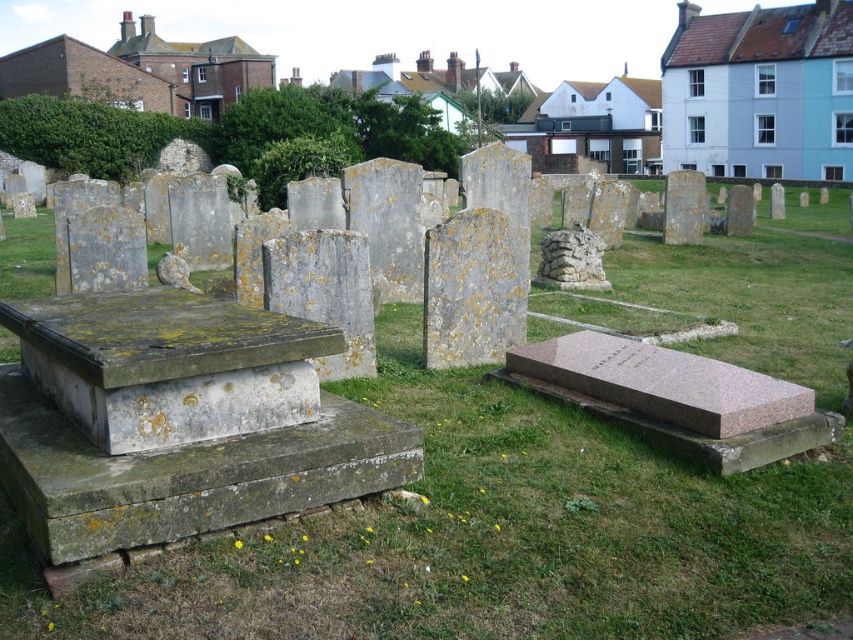
Who is positioned more to the right, green mossy grass at center or green mossy stone at center?

From the viewer's perspective, green mossy stone at center appears more on the right side.

Who is higher up, green mossy grass at center or green mossy stone at center?

green mossy grass at center is above.

Between point (6, 588) and point (454, 225), which one is positioned behind?

Positioned behind is point (454, 225).

You are a GUI agent. You are given a task and a screenshot of the screen. Output one action in this format:
    pyautogui.click(x=<x>, y=<y>)
    Task: Click on the green mossy grass at center
    This screenshot has height=640, width=853.
    Given the screenshot: What is the action you would take?
    pyautogui.click(x=491, y=536)